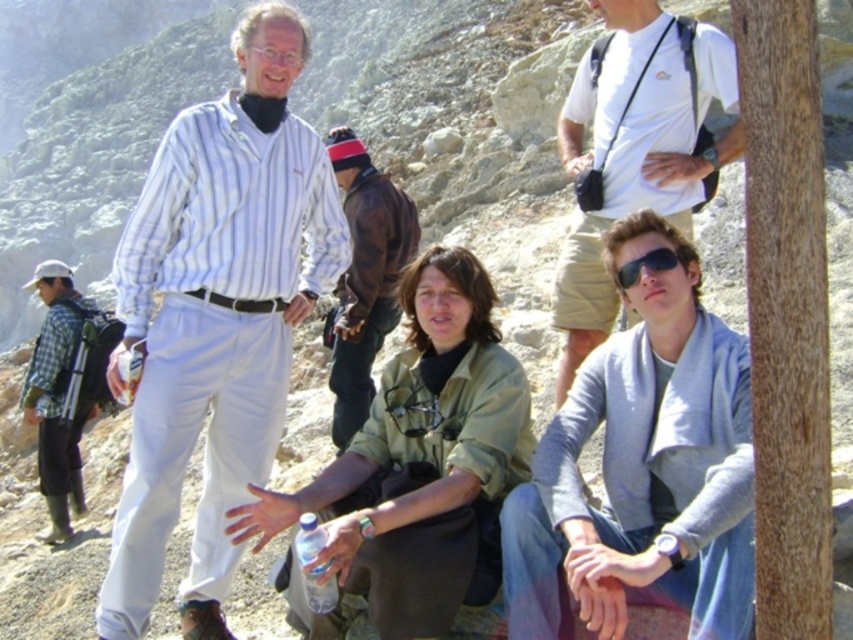
Based on the photo, who is shorter, green matte jacket at center or green plaid shirt at left?

With less height is green matte jacket at center.

Which is behind, point (440, 609) or point (68, 284)?

The point (68, 284) is more distant.

Which is behind, point (265, 493) or point (71, 292)?

The point (71, 292) is more distant.

Where is `green matte jacket at center`? The image size is (853, 640). green matte jacket at center is located at coordinates (422, 460).

Is point (282, 516) farther from camera compared to point (718, 35)?

No, (282, 516) is closer to viewer.

Is green matte jacket at center above white cotton t-shirt at upper center?

No.

The width and height of the screenshot is (853, 640). Identify the location of green matte jacket at center. (422, 460).

Measure the distance from white cotton t-shirt at upper center to leather jacket at center.

white cotton t-shirt at upper center is 9.94 meters away from leather jacket at center.

Is white cotton t-shirt at upper center taller than leather jacket at center?

Yes.

Where is `white cotton t-shirt at upper center`? This screenshot has width=853, height=640. white cotton t-shirt at upper center is located at coordinates (634, 198).

What are the coordinates of `white cotton t-shirt at upper center` in the screenshot? It's located at (634, 198).